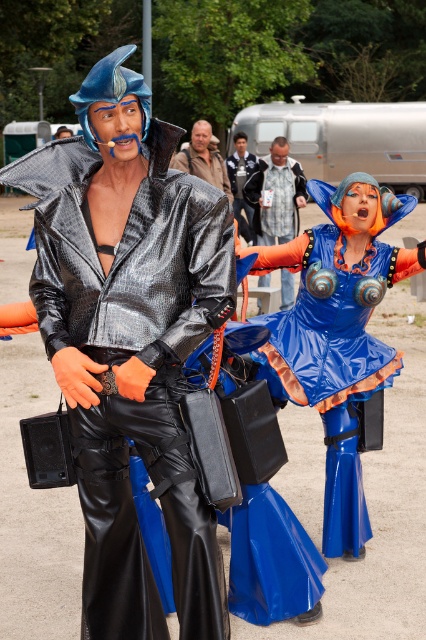
Does shiny metallic jacket at center have a larger size compared to brown leather jacket at center?

Yes, shiny metallic jacket at center is bigger than brown leather jacket at center.

Who is more distant from viewer, (88, 125) or (184, 166)?

Point (184, 166)

Who is more distant from viewer, (118,465) or (213,176)?

The point (213,176) is behind.

You are a GUI agent. You are given a task and a screenshot of the screen. Output one action in this format:
    pyautogui.click(x=<x>, y=<y>)
    Task: Click on the shiny metallic jacket at center
    This screenshot has height=640, width=426.
    Given the screenshot: What is the action you would take?
    pyautogui.click(x=129, y=342)

Is blue shiny dress at center in front of shiny black jacket at center?

Yes, blue shiny dress at center is in front of shiny black jacket at center.

Between blue shiny dress at center and shiny black jacket at center, which one appears on the left side from the viewer's perspective?

From the viewer's perspective, shiny black jacket at center appears more on the left side.

Who is more forward, (x=344, y=403) or (x=238, y=136)?

Point (x=344, y=403)

Find the location of a particular element. Image resolution: width=426 pixels, height=640 pixels. blue shiny dress at center is located at coordinates (339, 333).

Can you confirm if brown leather jacket at center is positioned below shiny black jacket at center?

Correct, brown leather jacket at center is located below shiny black jacket at center.

Is brown leather jacket at center wider than shiny black jacket at center?

Indeed, brown leather jacket at center has a greater width compared to shiny black jacket at center.

Is point (209, 122) closer to viewer compared to point (233, 188)?

Yes, it is.

Identify the location of brown leather jacket at center. The image size is (426, 640). (203, 157).